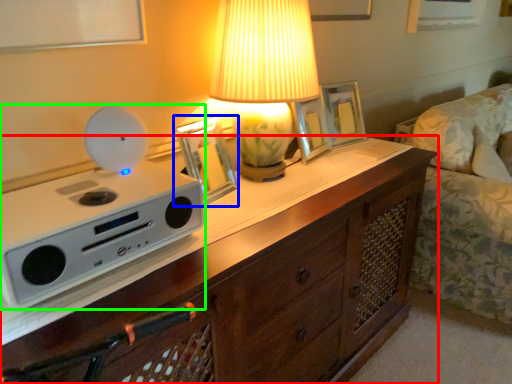
Question: Based on their relative distances, which object is farther from chest of drawers (highlighted by a red box)? Choose from picture frame (highlighted by a blue box) and appliance (highlighted by a green box).

Choices:
 (A) picture frame
 (B) appliance

Answer: (A)